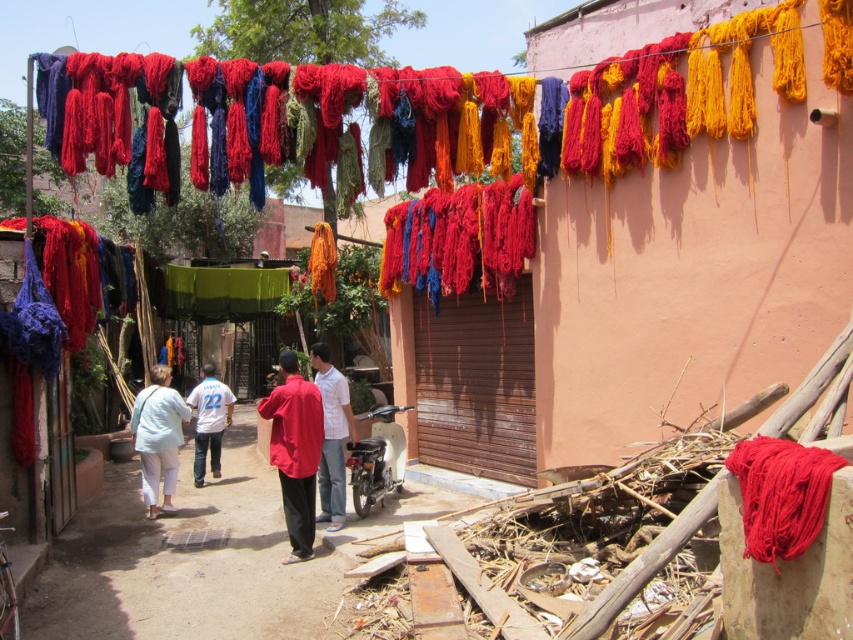
Who is positioned more to the left, matte red clothing at center or white jersey at center?

Positioned to the left is white jersey at center.

Consider the image. How much distance is there between matte red clothing at center and white jersey at center?

matte red clothing at center and white jersey at center are 2.97 meters apart.

Does point (201, 499) come in front of point (196, 444)?

Yes, point (201, 499) is closer to viewer.

The height and width of the screenshot is (640, 853). In order to click on matte red clothing at center in this screenshot , I will do `click(202, 560)`.

Who is positioned more to the left, matte red shirt at center or light blue cotton pants at center?

Positioned to the left is light blue cotton pants at center.

Which is in front, point (259, 410) or point (160, 465)?

Point (259, 410)

Is point (312, 536) positioned in front of point (143, 394)?

Yes, point (312, 536) is closer to viewer.

You are a GUI agent. You are given a task and a screenshot of the screen. Output one action in this format:
    pyautogui.click(x=<x>, y=<y>)
    Task: Click on the matte red shirt at center
    This screenshot has height=640, width=853.
    Given the screenshot: What is the action you would take?
    pyautogui.click(x=294, y=451)

Which is below, matte red clothing at center or matte white shirt at center?

matte red clothing at center

Can you confirm if matte red clothing at center is wider than matte white shirt at center?

Yes, matte red clothing at center is wider than matte white shirt at center.

Who is more forward, (320, 637) or (329, 401)?

Positioned in front is point (320, 637).

Identify the location of matte red clothing at center. This screenshot has height=640, width=853. (202, 560).